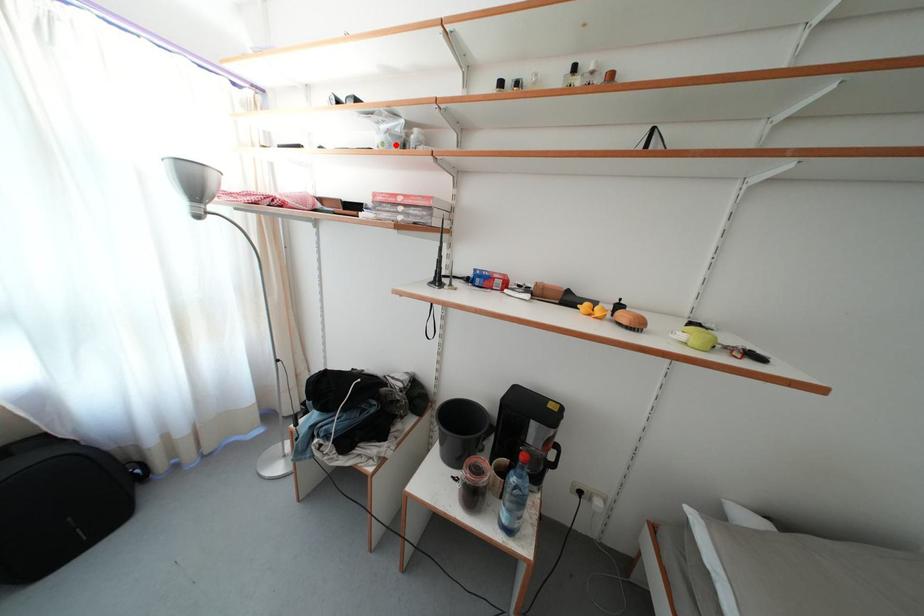
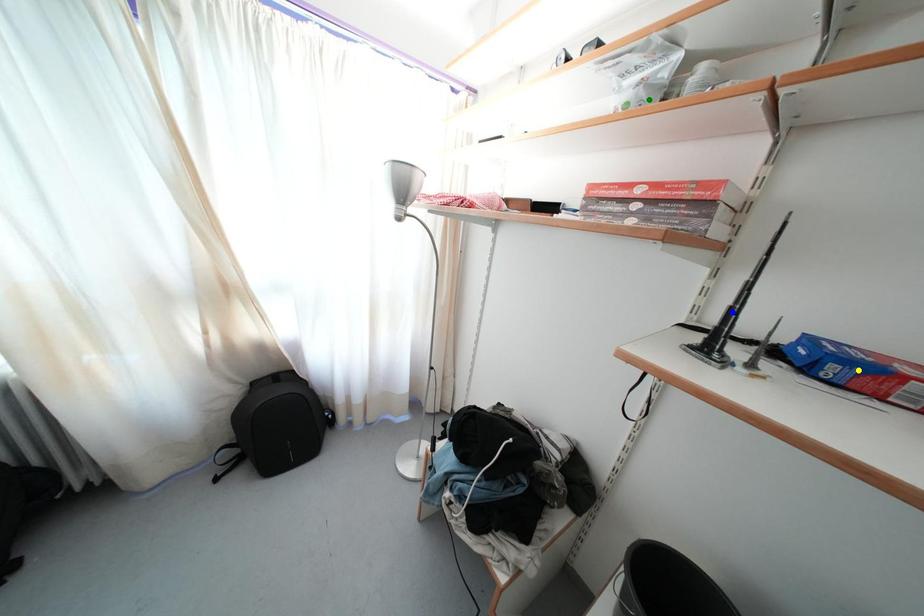
Question: I am providing you with two images of the same scene from different viewpoints. A red point is marked on the first image. You are given multiple points on the second image. In image 2, which mark is for the same physical point as the one in image 1?

Choices:
 (A) yellow point
 (B) green point
 (C) blue point

Answer: (B)